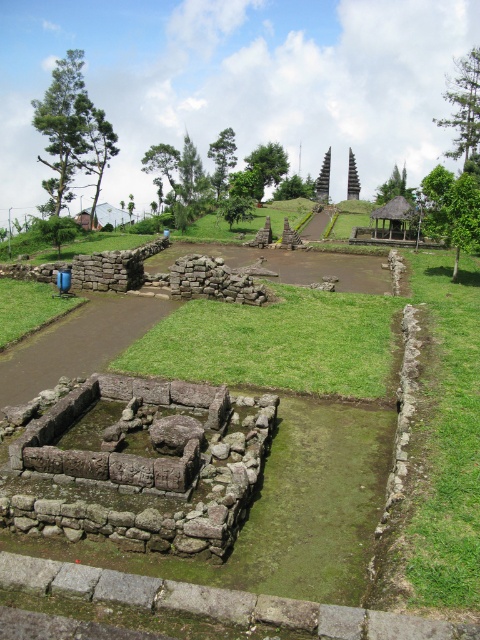
Question: Estimate the real-world distances between objects in this image. Which object is closer to the thatched wood hut at center?

Choices:
 (A) green grass at lower left
 (B) green grass at center
 (C) green mossy stone at center

Answer: (B)

Question: Does green grass at center have a smaller size compared to thatched wood hut at center?

Choices:
 (A) yes
 (B) no

Answer: (B)

Question: From the image, what is the correct spatial relationship of green grass at center in relation to thatched wood hut at center?

Choices:
 (A) below
 (B) above

Answer: (A)

Question: Which object is closer to the camera taking this photo?

Choices:
 (A) green mossy stone at center
 (B) green grass at lower left
 (C) stone pagoda at center
 (D) green grass at center

Answer: (A)

Question: In this image, where is green mossy stone at center located relative to green grass at center?

Choices:
 (A) right
 (B) left

Answer: (B)

Question: Which of the following is the farthest from the observer?

Choices:
 (A) (349, 566)
 (B) (396, 212)

Answer: (B)